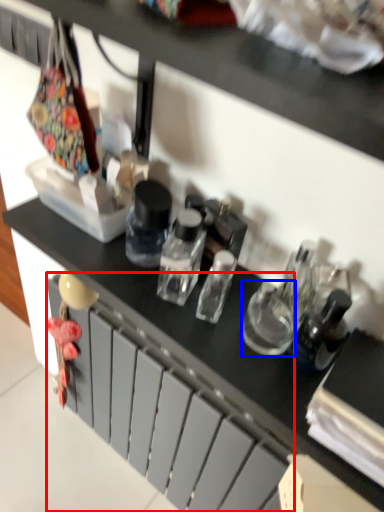
Question: Which point is closer to the camera, drawer (highlighted by a red box) or bottle (highlighted by a blue box)?

Choices:
 (A) drawer
 (B) bottle

Answer: (B)